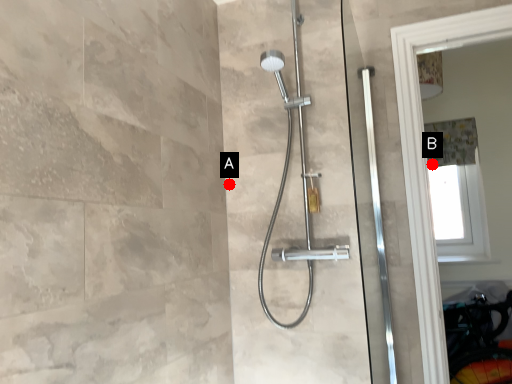
Question: Two points are circled on the image, labeled by A and B beside each circle. Among these points, which one is farthest from the camera?

Choices:
 (A) A is further
 (B) B is further

Answer: (B)